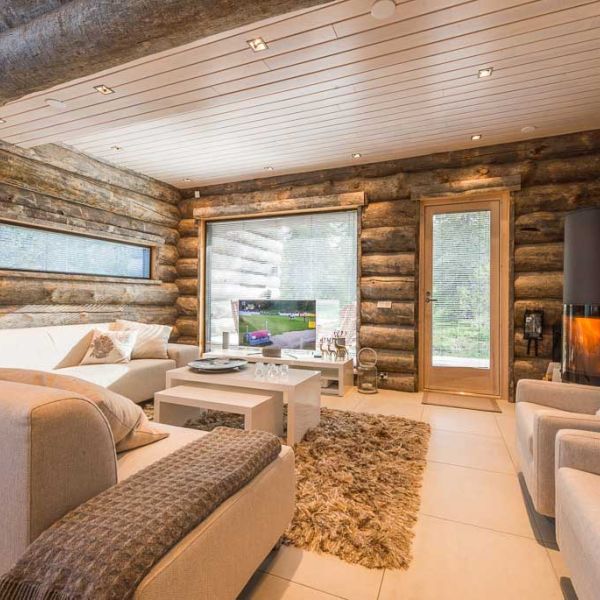
I want to click on floor rug and door mat, so click(371, 504), click(451, 397).